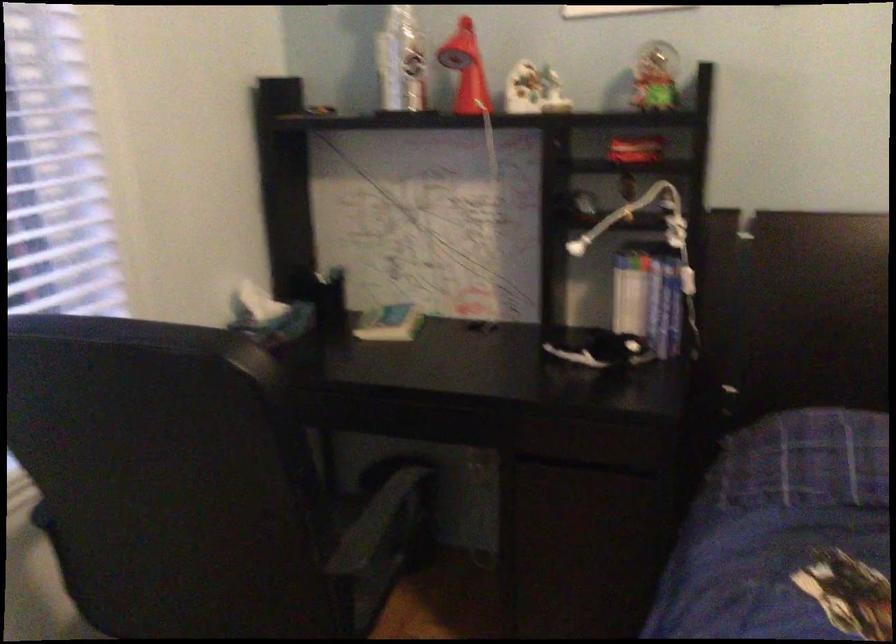
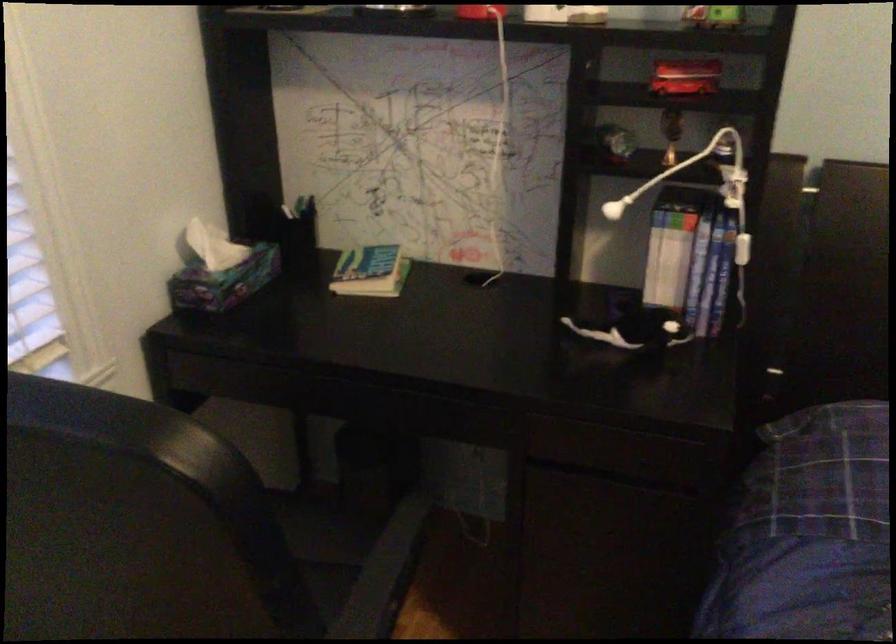
Where in the second image is the point corresponding to point (653, 98) from the first image?

(713, 17)